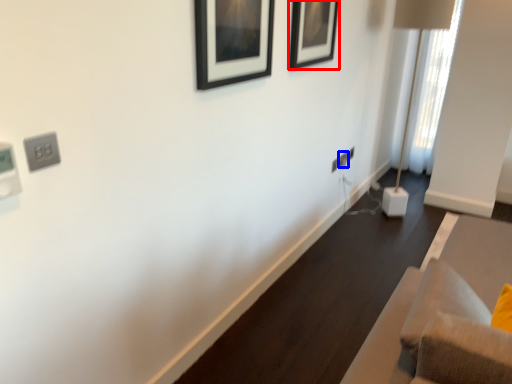
Question: Which object is closer to the camera taking this photo, picture frame (highlighted by a red box) or electric outlet (highlighted by a blue box)?

Choices:
 (A) picture frame
 (B) electric outlet

Answer: (A)